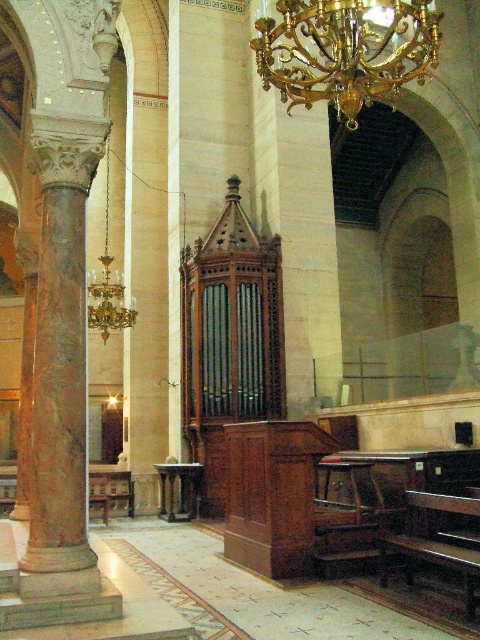
Question: Is marble column at left behind gold/gilded metal chandelier at upper center?

Choices:
 (A) no
 (B) yes

Answer: (A)

Question: Can you confirm if marble column at left is smaller than gold/gilded metal chandelier at upper center?

Choices:
 (A) no
 (B) yes

Answer: (B)

Question: Which of the following is the closest to the observer?

Choices:
 (A) marble column at left
 (B) gold/gilded metal chandelier at upper center

Answer: (A)

Question: Is marble column at left to the left of gold/gilded metal chandelier at upper center from the viewer's perspective?

Choices:
 (A) yes
 (B) no

Answer: (A)

Question: Among these points, which one is farthest from the camera?

Choices:
 (A) (38, 557)
 (B) (250, 42)

Answer: (B)